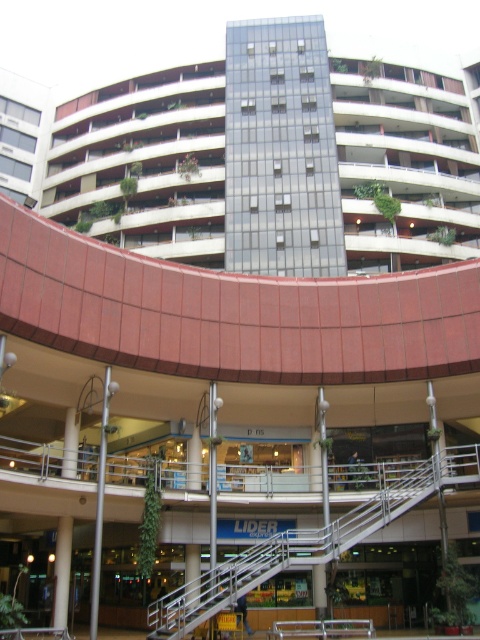
Question: Can you confirm if glassy concrete building at center is positioned to the left of metallic silver staircase at center?

Choices:
 (A) no
 (B) yes

Answer: (B)

Question: Which point is farther to the camera?

Choices:
 (A) metallic staircase at center
 (B) glassy concrete building at center

Answer: (B)

Question: Is glassy concrete building at center positioned in front of metallic staircase at center?

Choices:
 (A) yes
 (B) no

Answer: (B)

Question: Which object appears closest to the camera in this image?

Choices:
 (A) glassy concrete building at center
 (B) metallic silver staircase at center
 (C) metallic staircase at center

Answer: (B)

Question: Which object appears closest to the camera in this image?

Choices:
 (A) glassy concrete building at center
 (B) metallic staircase at center
 (C) metallic silver staircase at center

Answer: (C)

Question: Does glassy concrete building at center lie behind metallic staircase at center?

Choices:
 (A) yes
 (B) no

Answer: (A)